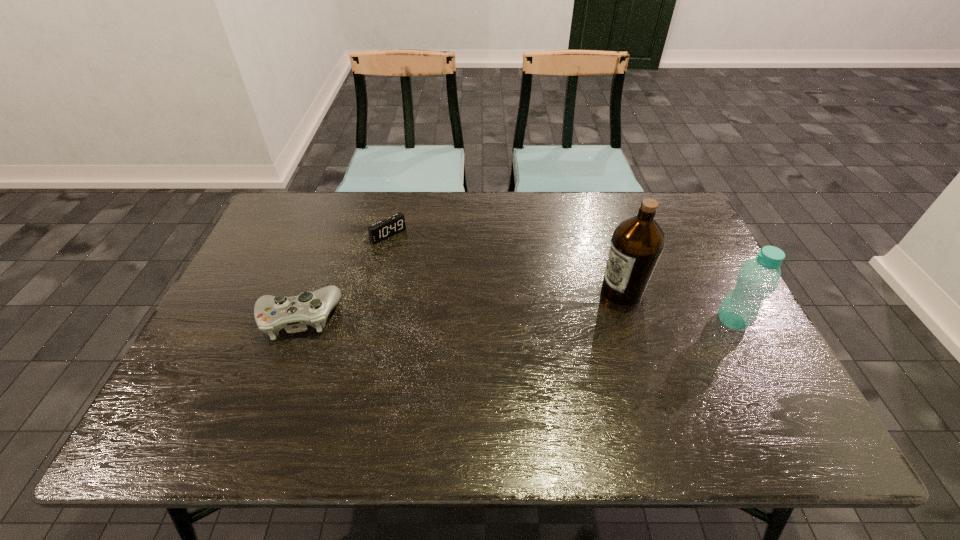
Find the location of a particular element. The width and height of the screenshot is (960, 540). vacant region located 0.210m on the label of the third object from left to right is located at coordinates (540, 329).

Identify the location of vacant space located on the label of the third object from left to right. (581, 310).

The image size is (960, 540). What are the coordinates of `blank space located 0.110m on the label of the third object from left to right` in the screenshot? It's located at (572, 315).

Where is `free region located 0.120m on the front-facing side of the third object from right to left`? This screenshot has width=960, height=540. free region located 0.120m on the front-facing side of the third object from right to left is located at coordinates (419, 264).

I want to click on vacant space located 0.150m on the front-facing side of the third object from right to left, so tap(424, 269).

This screenshot has width=960, height=540. What are the coordinates of `vacant region located 0.330m on the front-facing side of the third object from right to left` in the screenshot? It's located at (463, 305).

This screenshot has width=960, height=540. I want to click on object that is at the far edge, so click(x=384, y=229).

Find the location of a particular element. This screenshot has width=960, height=540. object at the left edge is located at coordinates (272, 313).

The width and height of the screenshot is (960, 540). What are the coordinates of `object located at the right edge` in the screenshot? It's located at (759, 277).

Identify the location of free space at the far edge. The image size is (960, 540). (586, 218).